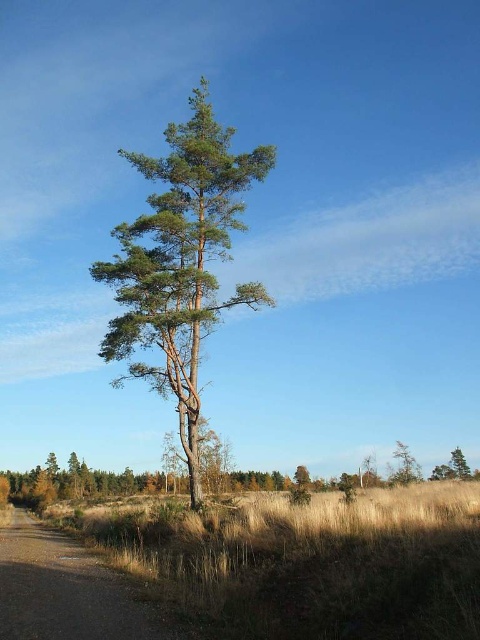
You are standing in the rural landscape and want to walk from the brown grass at lower center to the green matte tree at lower right. Which direction should you move relative to the tree?

You should move to the right relative to the green matte tree at lower right because the brown grass at lower center is located to its left side.